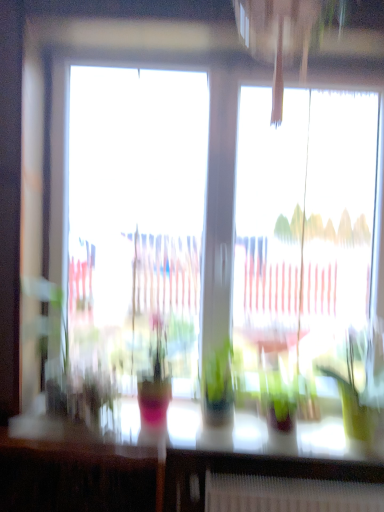
This screenshot has height=512, width=384. I want to click on vacant region above transparent glass window at center (from a real-world perspective), so click(x=291, y=57).